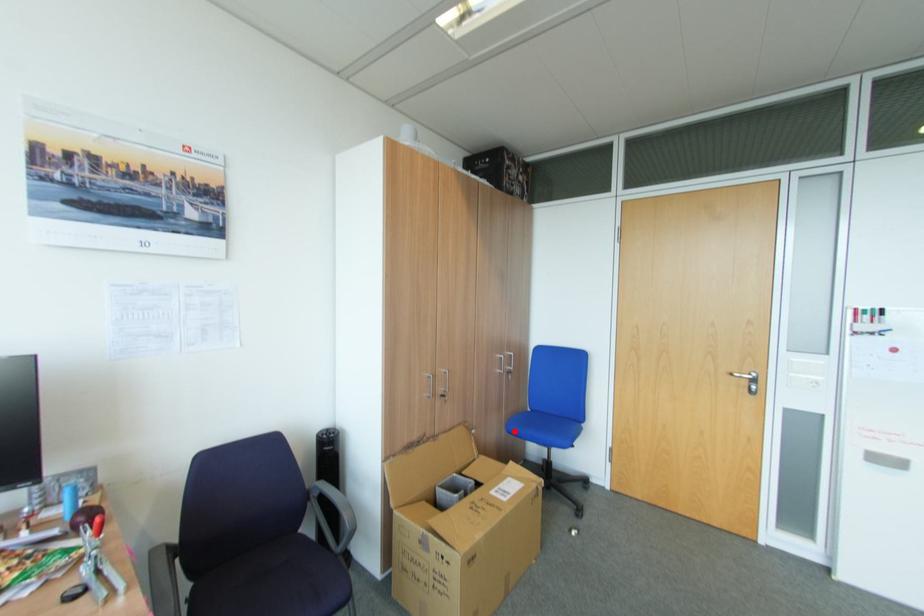
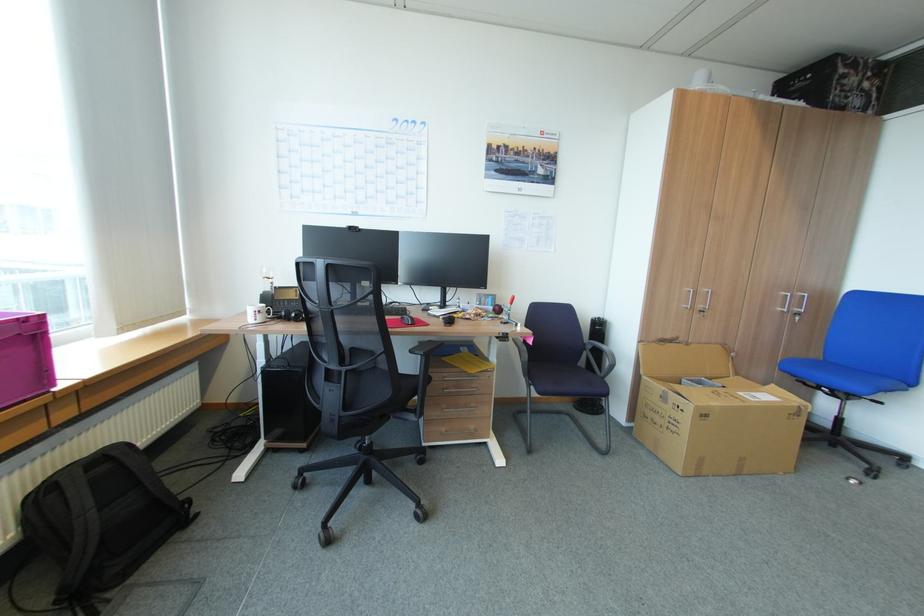
In the second image, find the point that corresponds to the highlighted location in the first image.

(786, 370)